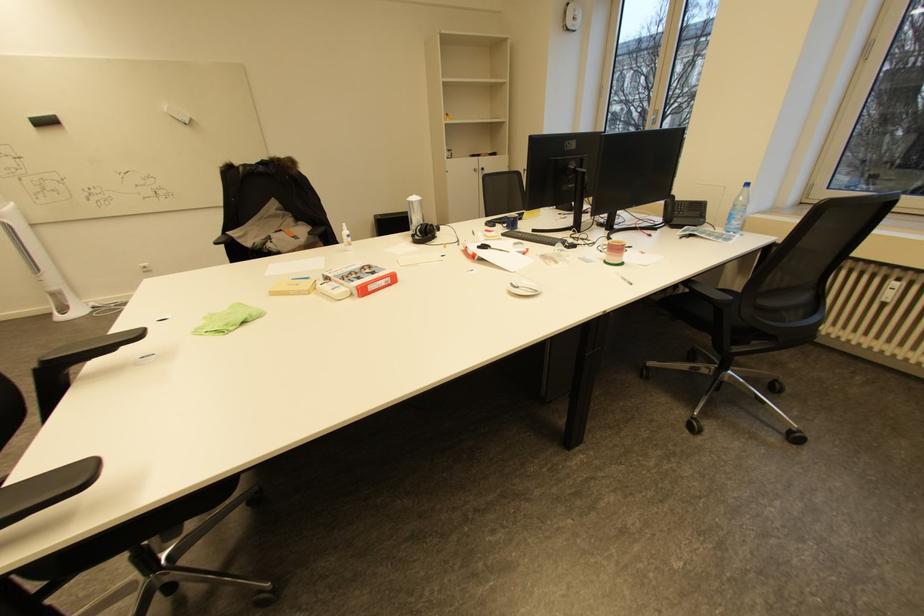
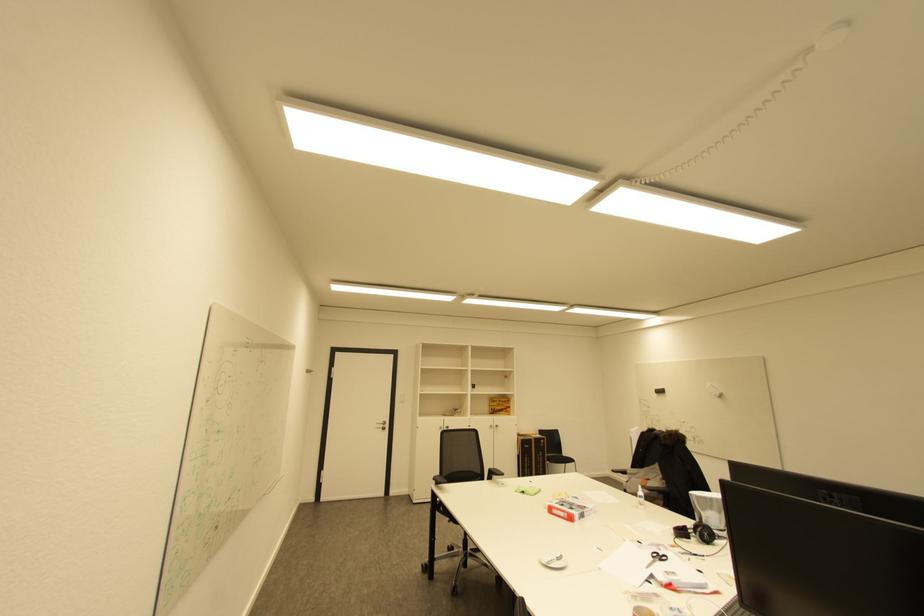
Where in the second image is the point corresponding to pixel 363 278 from the first image?

(568, 506)